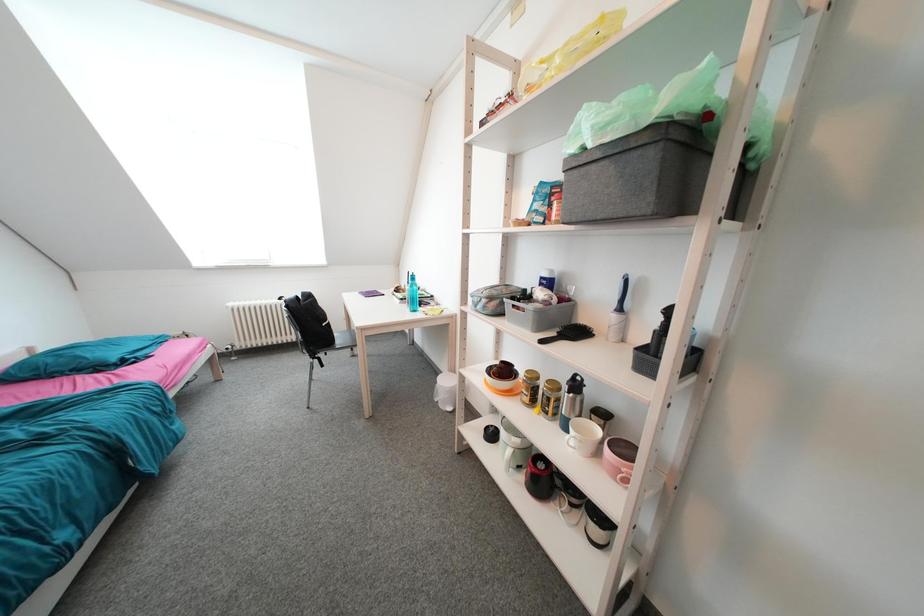
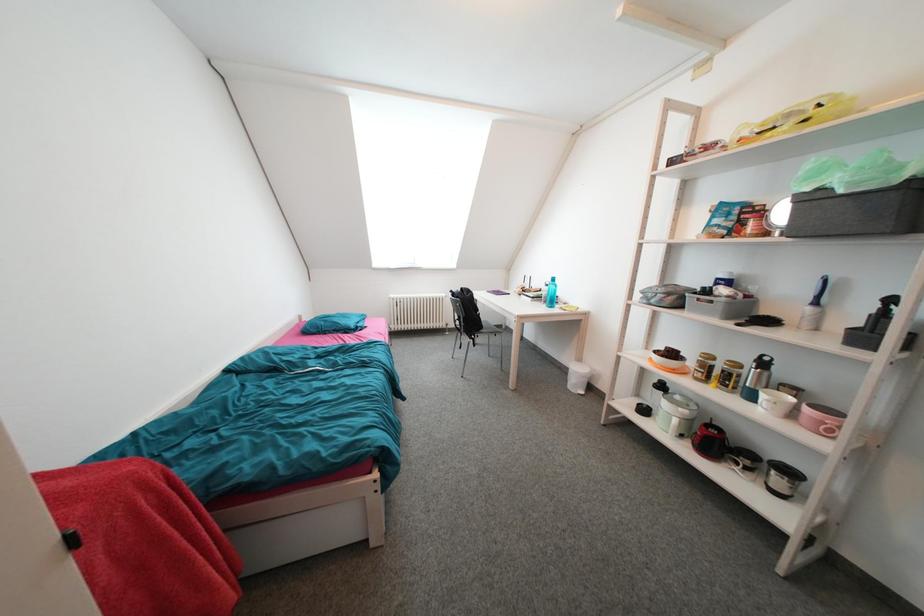
Question: The camera is either moving clockwise (left) or counter-clockwise (right) around the object. The first image is from the beginning of the video and the second image is from the end. Is the camera moving left or right when shooting the video?

Choices:
 (A) Left
 (B) Right

Answer: (B)